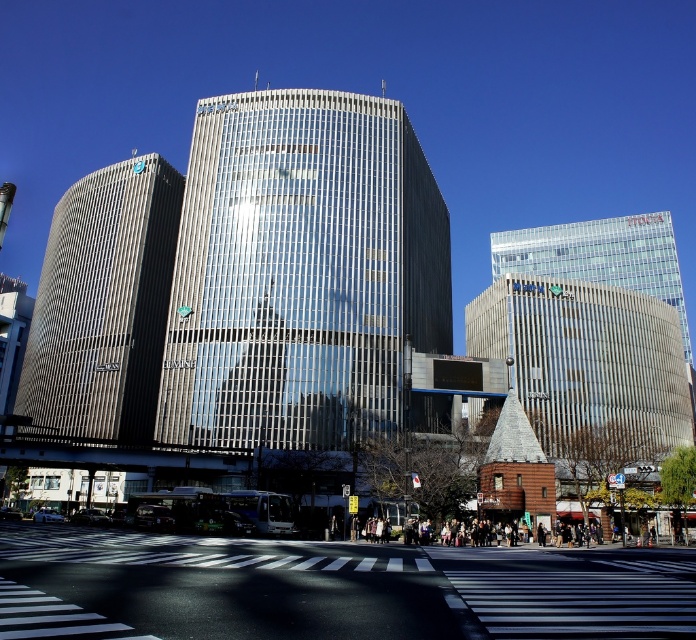
Looking at this image, you are a city planner assessing the urban layout. Given the brown wooden tower at center and the transparent glass building at upper right, which structure has a greater width when viewed from above?

The brown wooden tower at center might be wider than transparent glass building at upper right, so it likely has a greater width when viewed from above.

You are a city planner assessing the space between two buildings. You need to install a new billboard that must be wider than both the metallic silver building at left and the transparent glass building at upper right. Based on the scene, is this billboard feasible?

The metallic silver building at left is narrower than the transparent glass building at upper right, so the billboard must be wider than the transparent glass building at upper right to meet the requirement. However, without knowing the exact width of the billboard, it is impossible to confirm feasibility.

You are a city planner evaluating the urban layout. You notice the brown wooden tower at center and the transparent glass building at upper right. Which of these two structures is smaller in size?

The brown wooden tower at center is smaller compared to the transparent glass building at upper right according to the description.